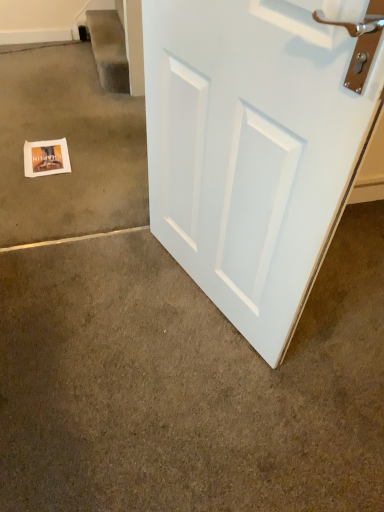
Find the location of a particular element. The height and width of the screenshot is (512, 384). blank space to the left of carpeted stairwell at upper left is located at coordinates (67, 63).